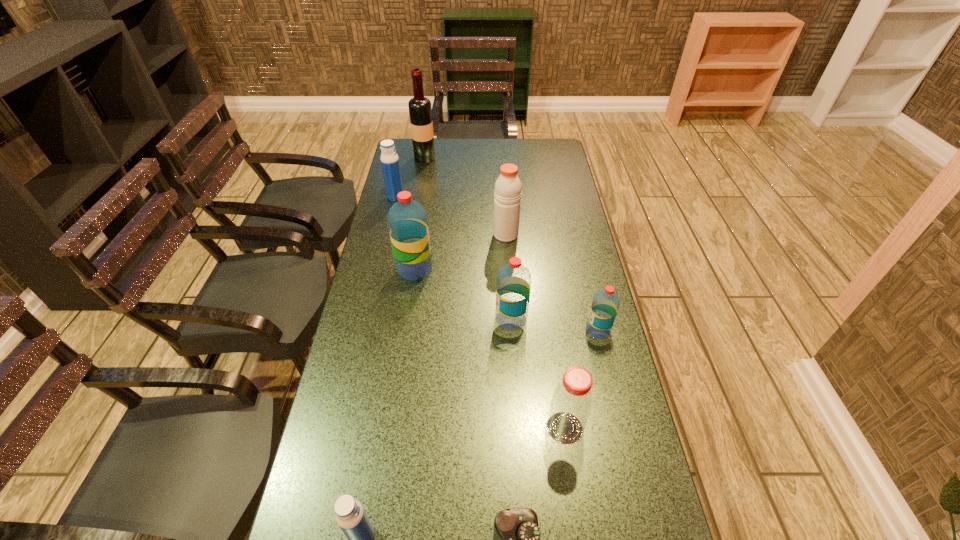
You are a GUI agent. You are given a task and a screenshot of the screen. Output one action in this format:
    pyautogui.click(x=<x>, y=<y>)
    Task: Click on the object that is the third closest one to the rightmost water bottle
    This screenshot has height=540, width=960.
    Given the screenshot: What is the action you would take?
    pyautogui.click(x=507, y=194)

Point out which water bottle is positioned as the second nearest to the leftmost water bottle. Please provide its 2D coordinates. Your answer should be formatted as a tuple, i.e. [(x, y)], where the tuple contains the x and y coordinates of a point satisfying the conditions above.

[(513, 286)]

Locate an element on the screen. This screenshot has width=960, height=540. the closest water bottle to the second red water bottle from left to right is located at coordinates (605, 304).

Find the location of a particular element. The image size is (960, 540). the second closest red water bottle relative to the leftmost water bottle is located at coordinates (513, 286).

Select which red water bottle appears as the second closest to the wine bottle. Please provide its 2D coordinates. Your answer should be formatted as a tuple, i.e. [(x, y)], where the tuple contains the x and y coordinates of a point satisfying the conditions above.

[(513, 286)]

You are a GUI agent. You are given a task and a screenshot of the screen. Output one action in this format:
    pyautogui.click(x=<x>, y=<y>)
    Task: Click on the vacant space that satisfies the following two spatial constraints: 1. on the back side of the leftmost object; 2. on the right side of the wine bottle
    
    Given the screenshot: What is the action you would take?
    pyautogui.click(x=405, y=158)

Identify the location of vacant region that satisfies the following two spatial constraints: 1. on the back side of the bottle; 2. on the front label of the second water bottle from right to left. (549, 319).

In order to click on free location that satisfies the following two spatial constraints: 1. on the back side of the third nearest object; 2. on the front label of the second farthest water bottle in this screenshot , I will do `click(542, 269)`.

Find the location of a particular element. free spot that satisfies the following two spatial constraints: 1. on the front side of the seventh nearest object; 2. on the right side of the red bottle is located at coordinates (518, 428).